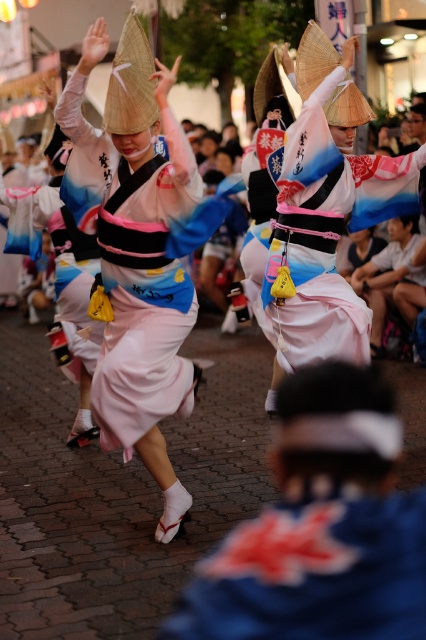
Question: Is blue silk kimono at center thinner than matte pink kimono at center?

Choices:
 (A) yes
 (B) no

Answer: (A)

Question: Does blue silk kimono at center appear under matte pink kimono at center?

Choices:
 (A) yes
 (B) no

Answer: (A)

Question: Among these objects, which one is nearest to the camera?

Choices:
 (A) blue silk kimono at center
 (B) matte pink kimono at center

Answer: (A)

Question: Which point is closer to the camera taking this photo?

Choices:
 (A) (308, 321)
 (B) (249, 612)

Answer: (B)

Question: Does blue silk kimono at center appear under matte pink kimono at center?

Choices:
 (A) yes
 (B) no

Answer: (A)